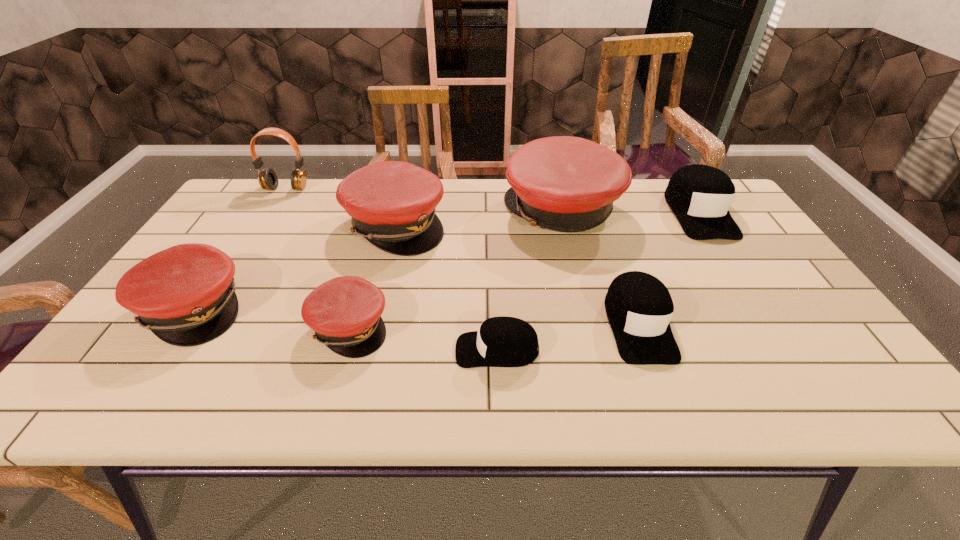
The height and width of the screenshot is (540, 960). What are the coordinates of `free space between the headset and the second black cap from left to right` in the screenshot? It's located at (463, 256).

I want to click on vacant area between the leftmost cap and the second black cap from left to right, so click(x=416, y=316).

In order to click on blank region between the brown headset and the smallest red cap in this screenshot , I will do `click(318, 258)`.

Where is `vacant space in between the second smallest red cap and the smallest red cap`? vacant space in between the second smallest red cap and the smallest red cap is located at coordinates (272, 318).

Find the location of a particular element. vacant space that is in between the brown headset and the shortest cap is located at coordinates (392, 269).

This screenshot has height=540, width=960. Identify the location of free space between the leftmost cap and the smallest red cap. (272, 318).

Where is `object that ranks as the fourth closest to the shortest object`? object that ranks as the fourth closest to the shortest object is located at coordinates (563, 183).

Find the location of a particular element. object that stands as the sixth closest to the second smallest red cap is located at coordinates (639, 307).

Image resolution: width=960 pixels, height=540 pixels. Identify the location of the fifth closest cap to the shortest cap. (185, 295).

Identify the location of cap that is the fifth nearest to the brown headset. This screenshot has height=540, width=960. (502, 341).